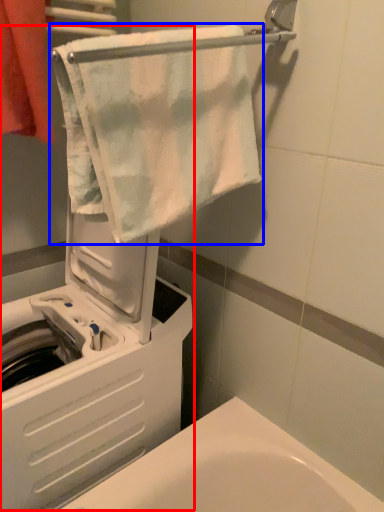
Question: Which object appears farthest to the camera in this image, machine (highlighted by a red box) or towel (highlighted by a blue box)?

Choices:
 (A) machine
 (B) towel

Answer: (A)